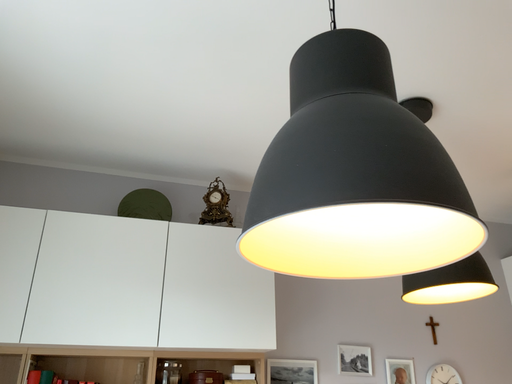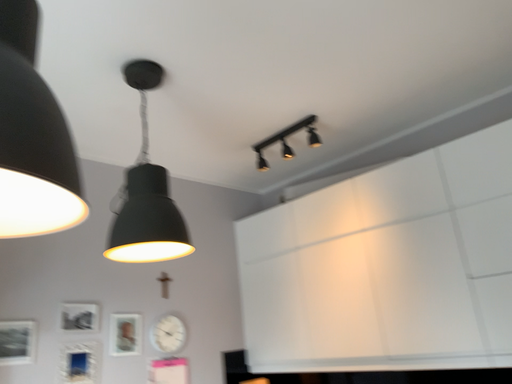
Question: Which way did the camera rotate in the video?

Choices:
 (A) rotated upward
 (B) rotated downward

Answer: (B)